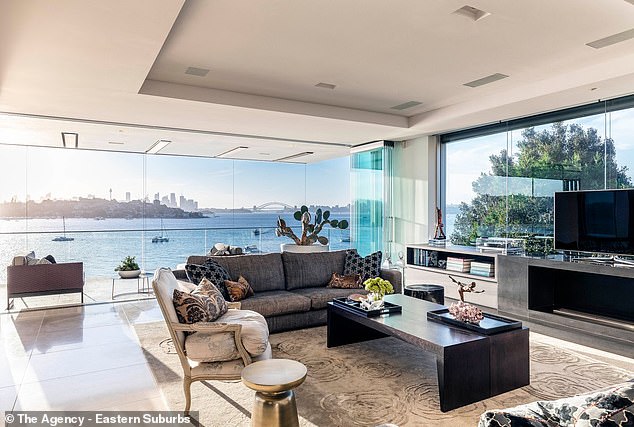
You are a GUI agent. You are given a task and a screenshot of the screen. Output one action in this format:
    pyautogui.click(x=<x>, y=<y>)
    Task: Click on the television
    This screenshot has height=427, width=634.
    Given the screenshot: What is the action you would take?
    pyautogui.click(x=104, y=26), pyautogui.click(x=603, y=220)